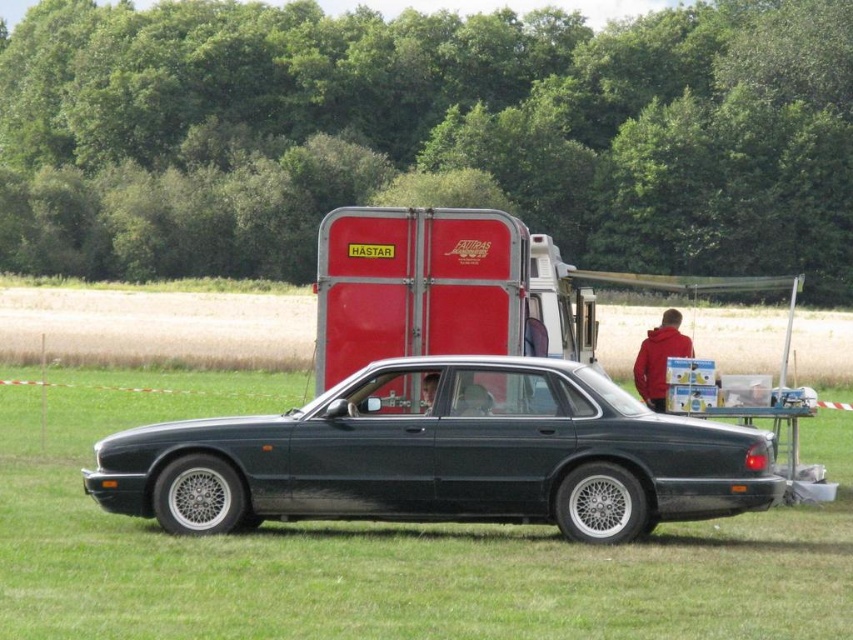
Who is more distant from viewer, (190,472) or (660,392)?

The point (660,392) is behind.

Can you confirm if metallic dark green sedan at center is taller than red fleece jacket at center?

Yes.

Which is behind, point (746, 500) or point (651, 330)?

Positioned behind is point (651, 330).

Locate an element on the screen. The width and height of the screenshot is (853, 640). metallic dark green sedan at center is located at coordinates 444,456.